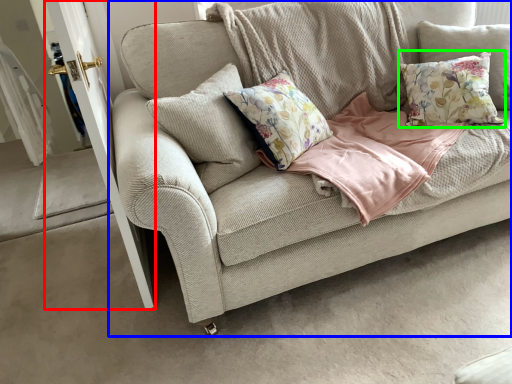
Question: Which object is the closest to the screen door (highlighted by a red box)? Choose among these: studio couch (highlighted by a blue box) or pillow (highlighted by a green box).

Choices:
 (A) studio couch
 (B) pillow

Answer: (A)